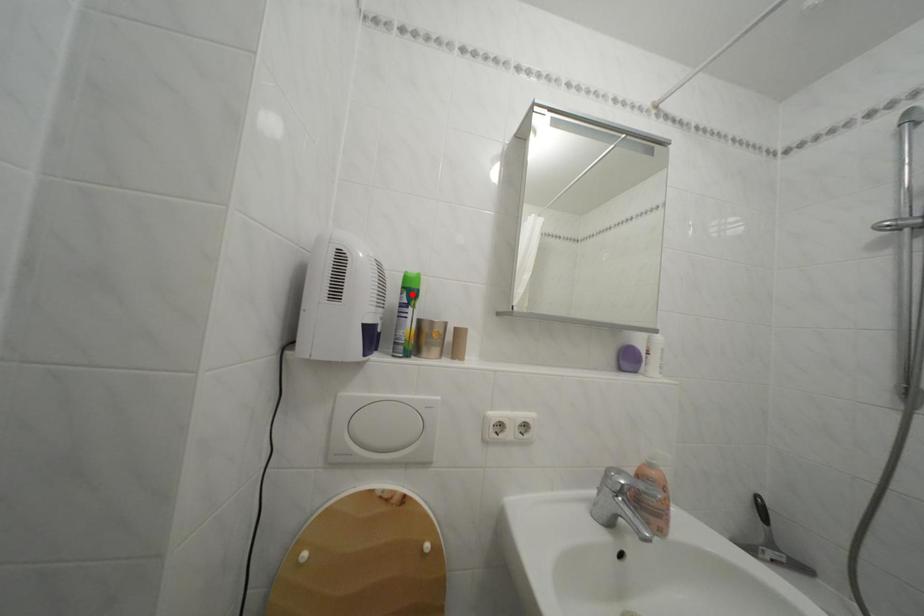
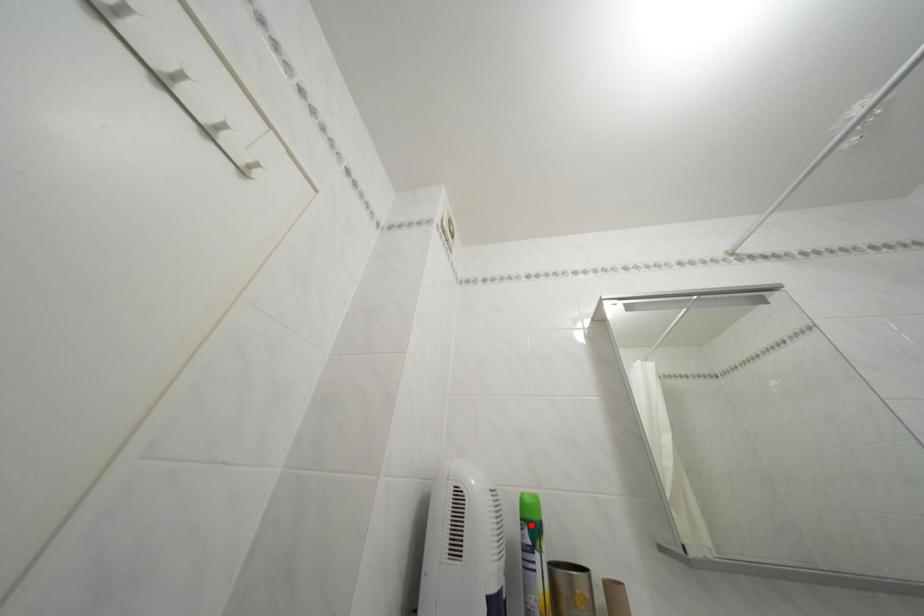
I am providing you with two images of the same scene from different viewpoints. A red point is marked on the first image and another point is marked on the second image. Are the points marked in image1 and image2 representing the same 3D position?

Yes